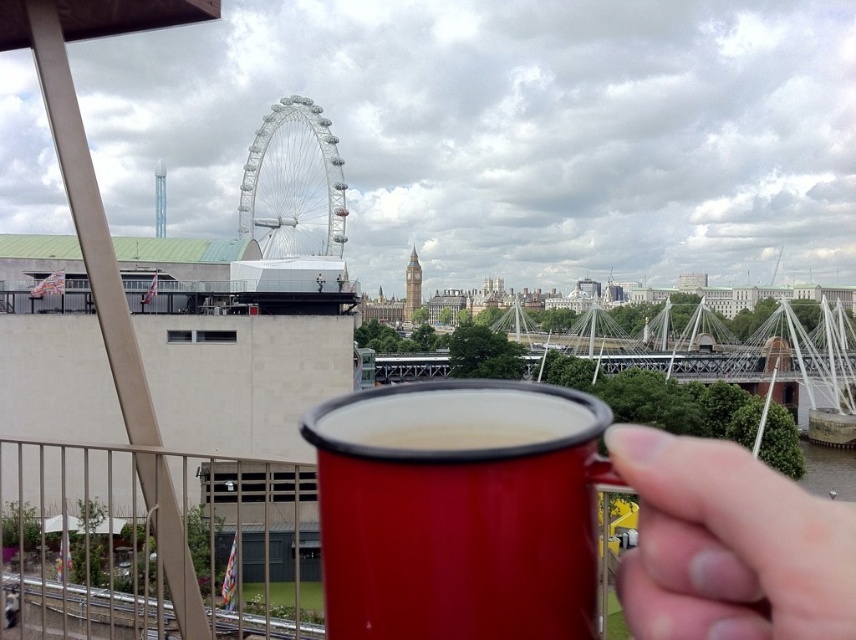
You are a person holding a red mug with a black rim. You want to place it on a table to your right. There is a point at lower right marked as point (729, 545). Is the hand at that point your own hand?

The point (729, 545) indicates a matte plastic hand at lower right, so yes, the hand at that point is your own hand holding the red mug with a black rim.

You are standing on a balcony overlooking a city. You see a matte plastic hand at lower right and a white metallic ferris wheel at center. Which object is closer to you?

The matte plastic hand at lower right is closer to you because it is positioned below the white metallic ferris wheel at center, indicating it is in the foreground.

You are a painter wanting to capture the view from the balcony. You have a canvas that can only fit objects up to the height of the red matte mug at center. Will the white metallic ferris wheel at center fit on your canvas?

The red matte mug at center has a lesser height compared to the white metallic ferris wheel at center. Since the canvas can only accommodate objects up to the mug height, the ferris wheel is taller and won not fit on the canvas.